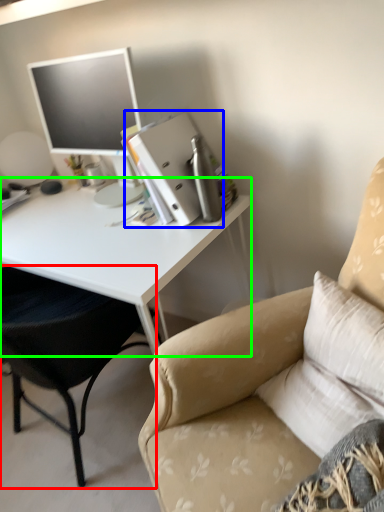
Question: Considering the real-world distances, which object is closest to chair (highlighted by a red box)? binder (highlighted by a blue box) or desk (highlighted by a green box).

Choices:
 (A) binder
 (B) desk

Answer: (B)